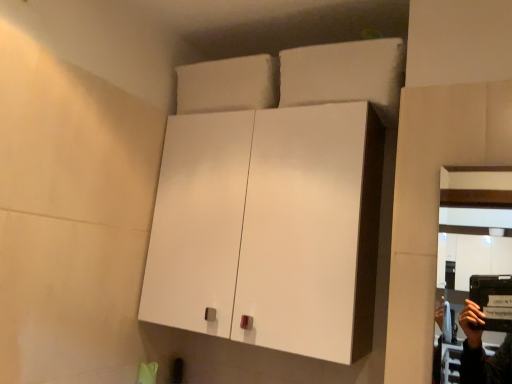
What do you see at coordinates (269, 228) in the screenshot? Image resolution: width=512 pixels, height=384 pixels. I see `white glossy cabinet at center` at bounding box center [269, 228].

Identify the location of white glossy cabinet at center. Image resolution: width=512 pixels, height=384 pixels. (269, 228).

Where is `white glossy cabinet at center`? white glossy cabinet at center is located at coordinates (269, 228).